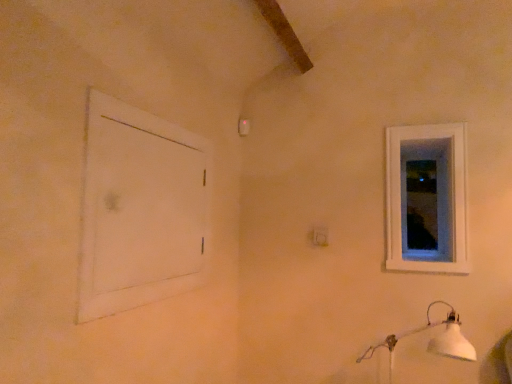
What do you see at coordinates (320, 236) in the screenshot?
I see `white plastic electric outlet at center` at bounding box center [320, 236].

What is the approximate width of white matte lamp at lower right?

white matte lamp at lower right is 12.13 inches wide.

This screenshot has width=512, height=384. What do you see at coordinates (426, 200) in the screenshot?
I see `transparent glass window at upper right` at bounding box center [426, 200].

The image size is (512, 384). Find the location of `white wooden window at upper right`. white wooden window at upper right is located at coordinates (426, 199).

Is point (387, 339) positioned after point (176, 286)?

That is True.

Does white matte lamp at lower right touch white matte door at left?

No, white matte lamp at lower right is not touching white matte door at left.

Image resolution: width=512 pixels, height=384 pixels. What are the coordinates of `window frame above the white matte lamp at lower right (from the image's perspective)` in the screenshot? It's located at (140, 209).

Where is `window screen that appears above the white matte door at left (from the image's perspective)`? window screen that appears above the white matte door at left (from the image's perspective) is located at coordinates (426, 200).

Can you tell me how much white matte door at left and transparent glass window at upper right differ in facing direction?

88.6 degrees.

From the image's perspective, between white matte door at left and transparent glass window at upper right, who is located below?

From the image's view, white matte door at left is below.

Could you tell me if white matte door at left is facing transparent glass window at upper right?

No, white matte door at left is not turned towards transparent glass window at upper right.

Consider the image. Is white plastic electric outlet at center far from white wooden window at upper right?

No, white plastic electric outlet at center is not far away from white wooden window at upper right.

Is white plastic electric outlet at center facing away from white wooden window at upper right?

No, white plastic electric outlet at center is not facing the opposite direction of white wooden window at upper right.

You are a GUI agent. You are given a task and a screenshot of the screen. Output one action in this format:
    pyautogui.click(x=<x>, y=<y>)
    Task: Click on the window above the white plastic electric outlet at center (from the image's perspective)
    The image size is (512, 384).
    Given the screenshot: What is the action you would take?
    426,199

From the image's perspective, between white plastic electric outlet at center and white wooden window at upper right, which one is located above?

From the image's view, white wooden window at upper right is above.

You are a GUI agent. You are given a task and a screenshot of the screen. Output one action in this format:
    pyautogui.click(x=<x>, y=<y>)
    Task: Click on the electric outlet above the white matte lamp at lower right (from a real-world perspective)
    Image resolution: width=512 pixels, height=384 pixels.
    Given the screenshot: What is the action you would take?
    pos(320,236)

Does white plastic electric outlet at center contain white matte lamp at lower right?

That's incorrect, white matte lamp at lower right is not inside white plastic electric outlet at center.

Is white plastic electric outlet at center not close to white matte lamp at lower right?

white plastic electric outlet at center is near white matte lamp at lower right, not far away.

Looking at this image, in the image, is white plastic electric outlet at center positioned in front of or behind white matte lamp at lower right?

Visually, white plastic electric outlet at center is located behind white matte lamp at lower right.

From the picture: From the image's perspective, which one is positioned higher, white wooden window at upper right or white matte lamp at lower right?

white wooden window at upper right, from the image's perspective.

Which object is more forward, white wooden window at upper right or white matte lamp at lower right?

white matte lamp at lower right is closer to the camera.

Is white wooden window at upper right positioned with its back to white matte lamp at lower right?

white wooden window at upper right is not turned away from white matte lamp at lower right.

The image size is (512, 384). Identify the location of window that is under the transparent glass window at upper right (from a real-world perspective). (426, 199).

Is point (428, 227) closer or farther from the camera than point (403, 245)?

Point (428, 227).

Which object is positioned more to the left, white wooden window at upper right or transparent glass window at upper right?

white wooden window at upper right.

Who is smaller, white wooden window at upper right or transparent glass window at upper right?

transparent glass window at upper right is smaller.

Relative to white plastic electric outlet at center, is white wooden window at upper right in front or behind?

white wooden window at upper right is positioned closer to the viewer than white plastic electric outlet at center.

Does white wooden window at upper right have a larger size compared to white plastic electric outlet at center?

Yes, white wooden window at upper right is bigger than white plastic electric outlet at center.

Between white wooden window at upper right and white plastic electric outlet at center, which one has larger width?

white plastic electric outlet at center.

From the picture: Is white wooden window at upper right not near white plastic electric outlet at center?

white wooden window at upper right is near white plastic electric outlet at center, not far away.

Identify the location of lamp on the right of white matte door at left. (431, 340).

Where is `window frame on the left of transparent glass window at upper right`? Image resolution: width=512 pixels, height=384 pixels. window frame on the left of transparent glass window at upper right is located at coordinates (140, 209).

From the picture: Estimate the real-world distances between objects in this image. Which object is further from transparent glass window at upper right, white matte door at left or white wooden window at upper right?

Based on the image, white matte door at left appears to be further to transparent glass window at upper right.

From the image, which object appears to be nearer to white matte lamp at lower right, white wooden window at upper right or white matte door at left?

Based on the image, white wooden window at upper right appears to be nearer to white matte lamp at lower right.

From the image, which object appears to be farther from white matte door at left, white wooden window at upper right or transparent glass window at upper right?

The object further to white matte door at left is transparent glass window at upper right.

From the picture: Estimate the real-world distances between objects in this image. Which object is closer to transparent glass window at upper right, white matte door at left or white matte lamp at lower right?

Among the two, white matte lamp at lower right is located nearer to transparent glass window at upper right.

Looking at the image, which one is located closer to white matte lamp at lower right, transparent glass window at upper right or white plastic electric outlet at center?

transparent glass window at upper right lies closer to white matte lamp at lower right than the other object.

When comparing their distances from white plastic electric outlet at center, does white matte lamp at lower right or white wooden window at upper right seem further?

white matte lamp at lower right is further to white plastic electric outlet at center.

From the image, which object appears to be farther from transparent glass window at upper right, white matte lamp at lower right or white matte door at left?

Among the two, white matte door at left is located further to transparent glass window at upper right.

In the scene shown: Based on their spatial positions, is transparent glass window at upper right or white plastic electric outlet at center further from white wooden window at upper right?

Based on the image, white plastic electric outlet at center appears to be further to white wooden window at upper right.

In order to click on lamp between white matte door at left and transparent glass window at upper right along the z-axis in this screenshot , I will do `click(431, 340)`.

This screenshot has width=512, height=384. In order to click on electric outlet between white matte door at left and transparent glass window at upper right along the z-axis in this screenshot , I will do `click(320, 236)`.

At what (x,y) coordinates should I click in order to perform the action: click on lamp situated between white matte door at left and white wooden window at upper right from left to right. Please return your answer as a coordinate pair (x, y). Image resolution: width=512 pixels, height=384 pixels. Looking at the image, I should click on (431, 340).

You are a GUI agent. You are given a task and a screenshot of the screen. Output one action in this format:
    pyautogui.click(x=<x>, y=<y>)
    Task: Click on the electric outlet that lies between white wooden window at upper right and white matte lamp at lower right from top to bottom
    This screenshot has height=384, width=512.
    Given the screenshot: What is the action you would take?
    pyautogui.click(x=320, y=236)